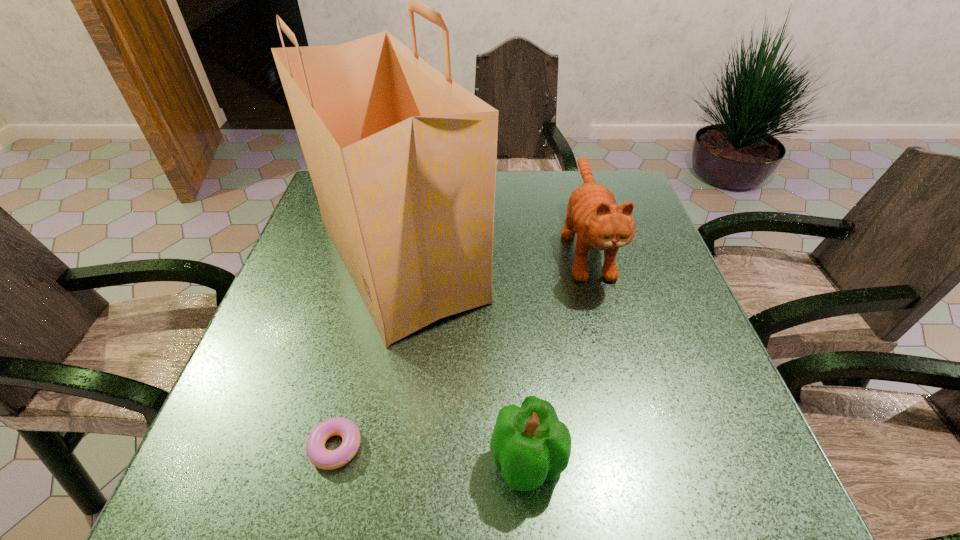
Where is `free region at the right edge of the desktop`? The height and width of the screenshot is (540, 960). free region at the right edge of the desktop is located at coordinates (667, 439).

The height and width of the screenshot is (540, 960). What are the coordinates of `blank space at the far right corner` in the screenshot? It's located at (622, 172).

Where is `vacant space that is in between the tallest object and the bell pepper`? vacant space that is in between the tallest object and the bell pepper is located at coordinates (464, 361).

The height and width of the screenshot is (540, 960). I want to click on vacant area that lies between the tallest object and the shortest object, so click(x=368, y=353).

Where is `free area in between the doughnut and the second shortest object`? The height and width of the screenshot is (540, 960). free area in between the doughnut and the second shortest object is located at coordinates (x=432, y=455).

You are a GUI agent. You are given a task and a screenshot of the screen. Output one action in this format:
    pyautogui.click(x=<x>, y=<y>)
    Task: Click on the free area in between the bell pepper and the tallest object
    
    Given the screenshot: What is the action you would take?
    pyautogui.click(x=464, y=361)

You are a GUI agent. You are given a task and a screenshot of the screen. Output one action in this format:
    pyautogui.click(x=<x>, y=<y>)
    Task: Click on the free spot between the second shortest object and the doughnut
    The image size is (960, 540).
    Given the screenshot: What is the action you would take?
    pyautogui.click(x=432, y=455)

Identify the location of empty space that is in between the second shortest object and the tallest object. The image size is (960, 540). (464, 361).

Identify which object is located as the second nearest to the tallest object. Please provide its 2D coordinates. Your answer should be formatted as a tuple, i.e. [(x, y)], where the tuple contains the x and y coordinates of a point satisfying the conditions above.

[(530, 444)]

Identify which object is the nearest to the shortest object. Please provide its 2D coordinates. Your answer should be formatted as a tuple, i.e. [(x, y)], where the tuple contains the x and y coordinates of a point satisfying the conditions above.

[(403, 159)]